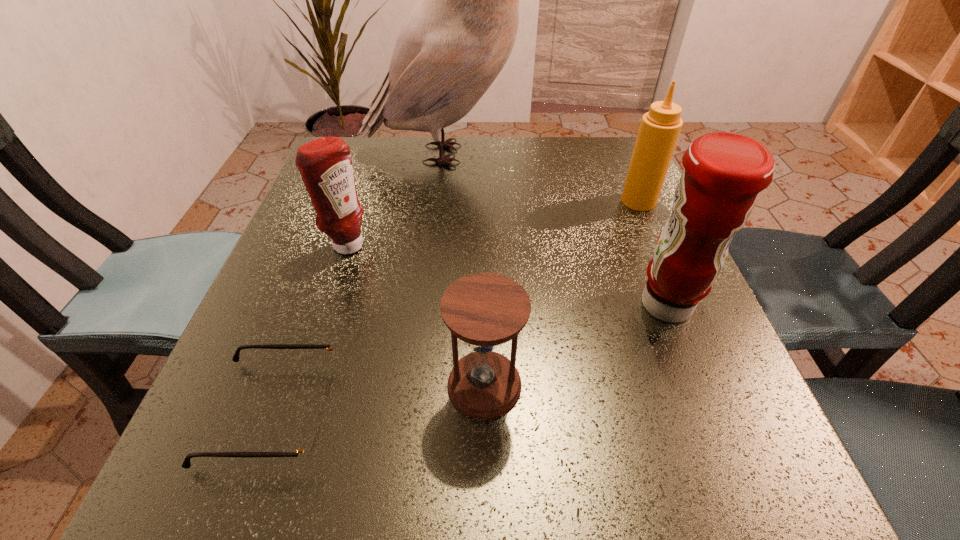
This screenshot has height=540, width=960. Identify the location of parakeet. (457, 39).

Locate an element on the screen. Image resolution: width=960 pixels, height=540 pixels. the farthest object is located at coordinates (457, 39).

This screenshot has width=960, height=540. In order to click on the nearest condiment in this screenshot , I will do click(x=723, y=173).

Where is `the farthest condiment`? the farthest condiment is located at coordinates (659, 130).

Where is `the second farthest condiment`? The width and height of the screenshot is (960, 540). the second farthest condiment is located at coordinates (325, 164).

At what (x,y) coordinates should I click in order to perform the action: click on the shortest condiment. Please return your answer as a coordinate pair (x, y). The height and width of the screenshot is (540, 960). Looking at the image, I should click on (325, 164).

The image size is (960, 540). I want to click on the fifth tallest object, so (x=484, y=310).

Locate an element on the screen. The image size is (960, 540). spectacles is located at coordinates (308, 446).

You are a GUI agent. You are given a task and a screenshot of the screen. Output one action in this format:
    pyautogui.click(x=<x>, y=<y>)
    Task: Click on the free location located on the face of the farthest object
    This screenshot has width=960, height=540.
    Given the screenshot: What is the action you would take?
    pyautogui.click(x=607, y=154)

Image resolution: width=960 pixels, height=540 pixels. Identify the location of vacant space located 0.190m on the back of the third nearest object. (630, 211).